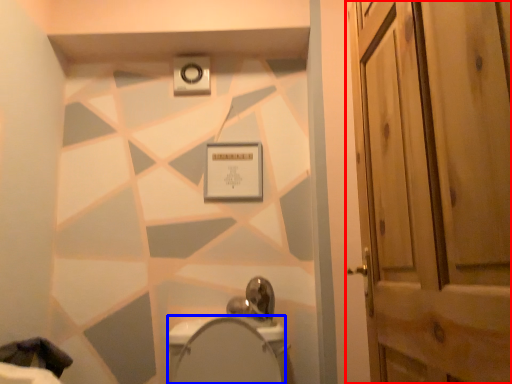
Question: Which of the following is the farthest to the observer, door (highlighted by a red box) or bidet (highlighted by a blue box)?

Choices:
 (A) door
 (B) bidet

Answer: (B)